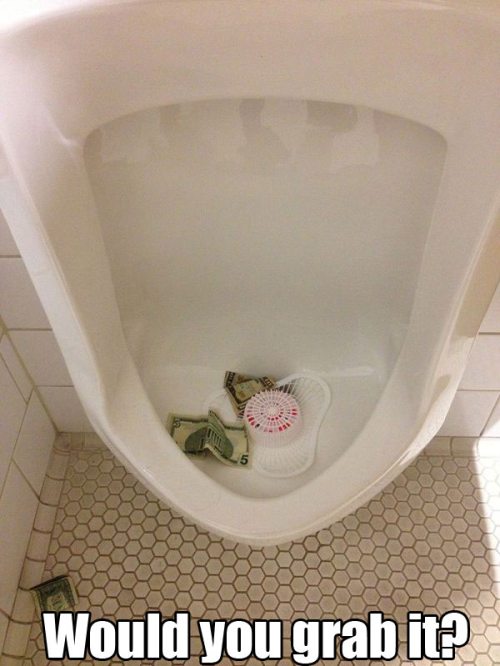
At what (x,y) coordinates should I click in order to perform the action: click on toilet. Please return your answer as a coordinate pair (x, y). The height and width of the screenshot is (666, 500). Looking at the image, I should click on (393, 83).